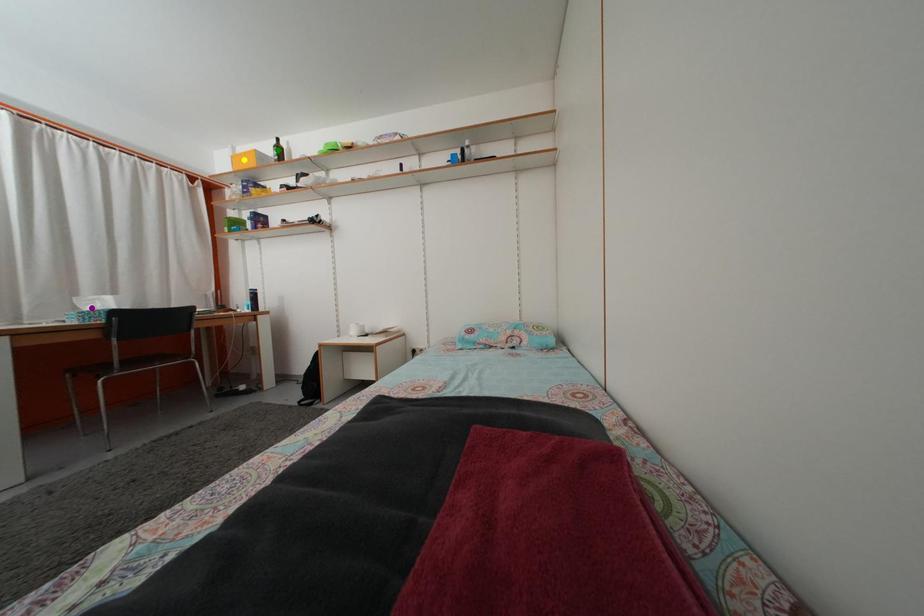
Order these from nearest to farthest:
purple point | yellow point | green point

purple point < yellow point < green point